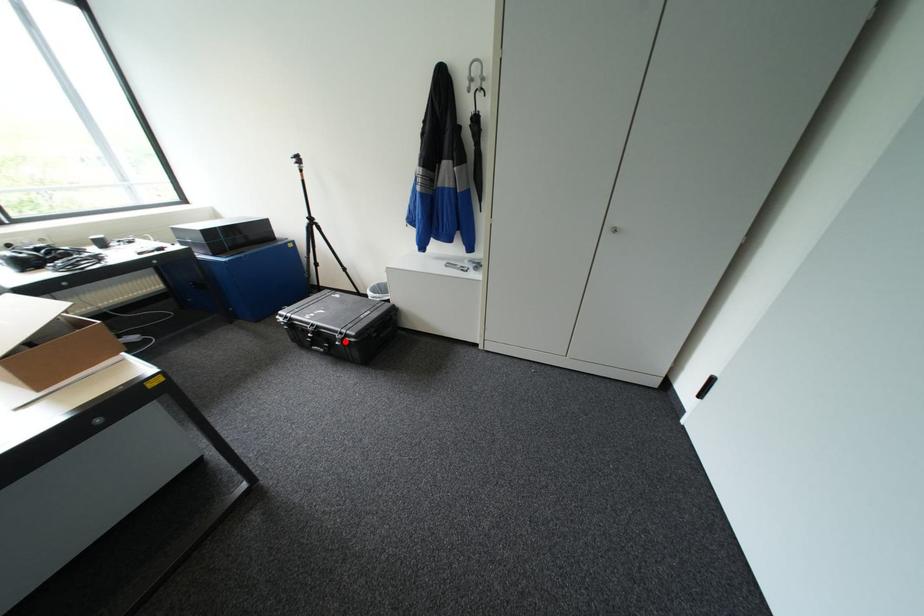
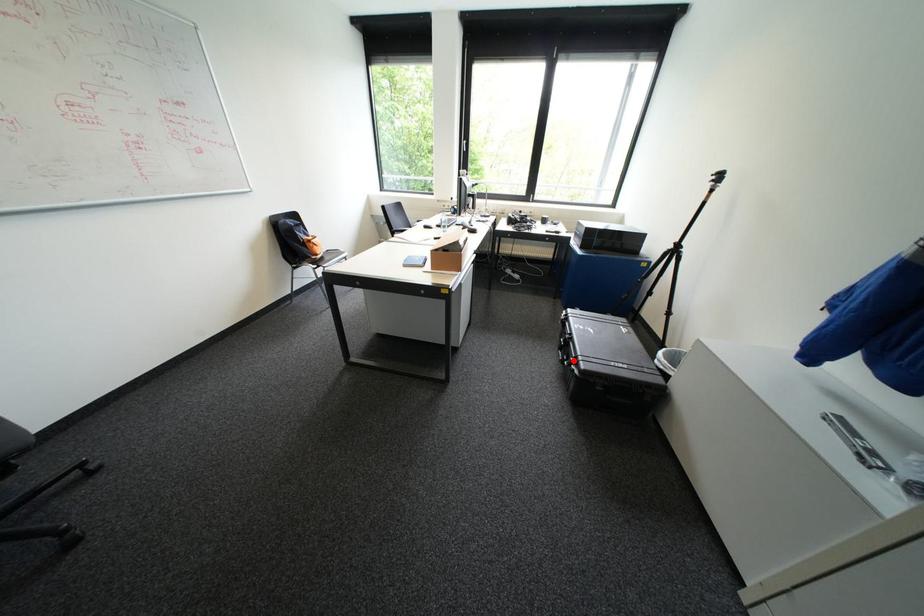
I am providing you with two images of the same scene from different viewpoints. A red point is marked on the first image and another point is marked on the second image. Is the red point in image1 aligned with the point shown in image2?

Yes